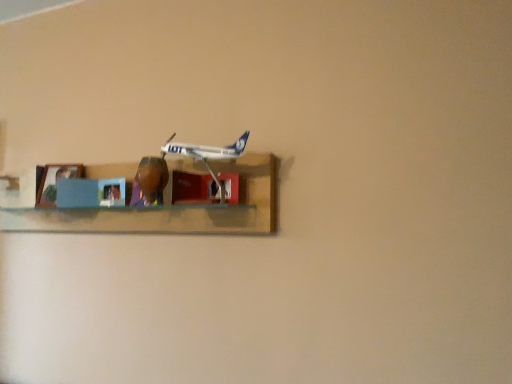
Question: Considering the relative sizes of wooden shelf at center and white plastic airplane at center in the image provided, is wooden shelf at center wider than white plastic airplane at center?

Choices:
 (A) no
 (B) yes

Answer: (B)

Question: From a real-world perspective, is wooden shelf at center over white plastic airplane at center?

Choices:
 (A) no
 (B) yes

Answer: (A)

Question: Is the depth of wooden shelf at center greater than that of white plastic airplane at center?

Choices:
 (A) yes
 (B) no

Answer: (A)

Question: Considering the relative sizes of wooden shelf at center and white plastic airplane at center in the image provided, is wooden shelf at center bigger than white plastic airplane at center?

Choices:
 (A) yes
 (B) no

Answer: (A)

Question: From the image's perspective, is wooden shelf at center on top of white plastic airplane at center?

Choices:
 (A) no
 (B) yes

Answer: (A)

Question: Is wooden shelf at center next to white plastic airplane at center and touching it?

Choices:
 (A) yes
 (B) no

Answer: (B)

Question: Is wooden shelf at center oriented towards matte blue picture frame at left?

Choices:
 (A) no
 (B) yes

Answer: (B)

Question: Is the surface of wooden shelf at center in direct contact with matte blue picture frame at left?

Choices:
 (A) yes
 (B) no

Answer: (B)

Question: Is wooden shelf at center facing away from matte blue picture frame at left?

Choices:
 (A) yes
 (B) no

Answer: (A)

Question: Is matte blue picture frame at left a part of wooden shelf at center?

Choices:
 (A) no
 (B) yes

Answer: (B)

Question: Would you say wooden shelf at center is a long distance from matte blue picture frame at left?

Choices:
 (A) yes
 (B) no

Answer: (B)

Question: Is wooden shelf at center at the left side of matte blue picture frame at left?

Choices:
 (A) no
 (B) yes

Answer: (A)

Question: Would you say wooden shelf at center is part of white plastic airplane at center's contents?

Choices:
 (A) no
 (B) yes

Answer: (A)